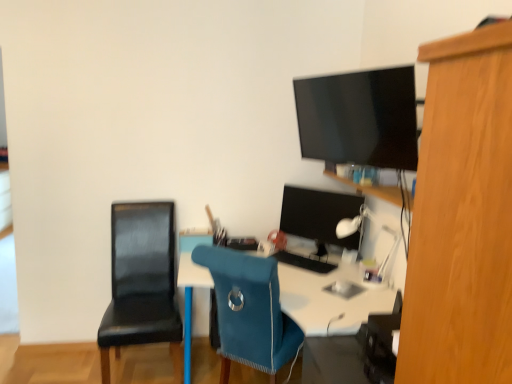
Locate an element on the screen. The image size is (512, 384). white glossy desk at center is located at coordinates (329, 300).

Can black matte keyboard at center be found inside white glossy desk at center?

No.

Which of these two, white glossy desk at center or black matte keyboard at center, is smaller?

A: With smaller size is black matte keyboard at center.

From the picture: Does white glossy desk at center lie behind black matte keyboard at center?

No, the depth of white glossy desk at center is less than that of black matte keyboard at center.

Would you consider white glossy desk at center to be distant from black matte keyboard at center?

No, there isn't a large distance between white glossy desk at center and black matte keyboard at center.

From the picture: From a real-world perspective, is blue fabric chair at center, which is counted as the first chair, starting from the right, beneath matte black monitor at center?

Indeed, from a real-world perspective, blue fabric chair at center, which is counted as the first chair, starting from the right, is positioned beneath matte black monitor at center.

Where is `computer monitor that appears above the blue fabric chair at center, which is counted as the first chair, starting from the right (from the image's perspective)`? computer monitor that appears above the blue fabric chair at center, which is counted as the first chair, starting from the right (from the image's perspective) is located at coordinates (318, 214).

Considering the relative sizes of blue fabric chair at center, the second chair in the left-to-right sequence, and matte black monitor at center in the image provided, is blue fabric chair at center, the second chair in the left-to-right sequence, bigger than matte black monitor at center?

Yes, blue fabric chair at center, the second chair in the left-to-right sequence, is bigger than matte black monitor at center.

Is blue fabric chair at center, which is counted as the first chair, starting from the right, taller than matte black monitor at center?

Yes, blue fabric chair at center, which is counted as the first chair, starting from the right, is taller than matte black monitor at center.

Is black matte keyboard at center looking in the opposite direction of white plastic lamp at upper right?

No, black matte keyboard at center is not facing the opposite direction of white plastic lamp at upper right.

Is black matte keyboard at center with white plastic lamp at upper right?

No, black matte keyboard at center is not touching white plastic lamp at upper right.

Considering the positions of point (322, 268) and point (350, 225), is point (322, 268) closer or farther from the camera than point (350, 225)?

Point (322, 268) is positioned farther from the camera compared to point (350, 225).

From the picture: Which object is more forward, black matte keyboard at center or white plastic lamp at upper right?

white plastic lamp at upper right.

Can you confirm if black matte keyboard at center is positioned to the right of blue fabric chair at center, the second chair in the left-to-right sequence?

Indeed, black matte keyboard at center is positioned on the right side of blue fabric chair at center, the second chair in the left-to-right sequence.

Does point (296, 257) come farther from viewer compared to point (275, 374)?

Yes, it is behind point (275, 374).

Is black matte keyboard at center behind blue fabric chair at center, the second chair in the left-to-right sequence?

Yes.

Considering the positions of point (307, 259) and point (134, 254), is point (307, 259) closer or farther from the camera than point (134, 254)?

Point (307, 259) appears to be farther away from the viewer than point (134, 254).

Is black matte keyboard at center situated inside black leather chair at left, acting as the first chair starting from the left, or outside?

black matte keyboard at center is outside black leather chair at left, acting as the first chair starting from the left.

Is black matte keyboard at center aimed at black leather chair at left, placed as the second chair when sorted from right to left?

No.

Are black matte keyboard at center and black leather chair at left, placed as the second chair when sorted from right to left, beside each other?

No, black matte keyboard at center is not in contact with black leather chair at left, placed as the second chair when sorted from right to left.

Can you confirm if matte black monitor at center is bigger than blue fabric chair at center, the second chair in the left-to-right sequence?

No.

The image size is (512, 384). There is a matte black monitor at center. What are the coordinates of `the 2nd chair below it (from a real-world perspective)` in the screenshot? It's located at (250, 311).

Choose the correct answer: Is matte black monitor at center inside blue fabric chair at center, which is counted as the first chair, starting from the right, or outside it?

matte black monitor at center cannot be found inside blue fabric chair at center, which is counted as the first chair, starting from the right.

Is point (344, 212) positioned in front of point (251, 322)?

That is False.

From a real-world perspective, which object rests below the other?

In real-world perspective, white glossy desk at center is lower.

Is point (353, 264) farther from camera compared to point (326, 233)?

That is False.

Looking at this image, does white glossy desk at center turn towards matte black monitor at center?

No.

Identify the location of keyboard that is on the right side of white glossy desk at center. Image resolution: width=512 pixels, height=384 pixels. (304, 262).

Image resolution: width=512 pixels, height=384 pixels. What are the coordinates of `the 2nd chair in front of the matte black monitor at center` in the screenshot? It's located at (250, 311).

Based on their spatial positions, is black matte keyboard at center or black leather chair at left, acting as the first chair starting from the left, further from blue fabric chair at center, the second chair in the left-to-right sequence?

Based on the image, black leather chair at left, acting as the first chair starting from the left, appears to be further to blue fabric chair at center, the second chair in the left-to-right sequence.

Estimate the real-world distances between objects in this image. Which object is further from blue fabric chair at center, which is counted as the first chair, starting from the right, white plastic lamp at upper right or matte black monitor at center?

Among the two, matte black monitor at center is located further to blue fabric chair at center, which is counted as the first chair, starting from the right.

Based on their spatial positions, is blue fabric chair at center, the second chair in the left-to-right sequence, or matte black monitor at center closer to black leather chair at left, acting as the first chair starting from the left?

blue fabric chair at center, the second chair in the left-to-right sequence, lies closer to black leather chair at left, acting as the first chair starting from the left, than the other object.

Considering their positions, is matte black monitor at center positioned further to white glossy desk at center than black matte keyboard at center?

The object further to white glossy desk at center is matte black monitor at center.

In the scene shown: Estimate the real-world distances between objects in this image. Which object is closer to black matte keyboard at center, blue fabric chair at center, which is counted as the first chair, starting from the right, or white glossy desk at center?

white glossy desk at center is closer to black matte keyboard at center.

Which object lies nearer to the anchor point black matte keyboard at center, black leather chair at left, acting as the first chair starting from the left, or blue fabric chair at center, the second chair in the left-to-right sequence?

blue fabric chair at center, the second chair in the left-to-right sequence.

When comparing their distances from white glossy desk at center, does matte black monitor at center or black leather chair at left, acting as the first chair starting from the left, seem further?

black leather chair at left, acting as the first chair starting from the left.

From the image, which object appears to be nearer to matte black monitor at center, white glossy desk at center or blue fabric chair at center, which is counted as the first chair, starting from the right?

white glossy desk at center is closer to matte black monitor at center.

This screenshot has height=384, width=512. In order to click on lamp between white glossy desk at center and black matte keyboard at center in the front-back direction in this screenshot , I will do `click(378, 228)`.

I want to click on desk situated between black leather chair at left, placed as the second chair when sorted from right to left, and white plastic lamp at upper right from left to right, so click(329, 300).

Identify the location of chair between black leather chair at left, placed as the second chair when sorted from right to left, and matte black monitor at center. (250, 311).

You are a GUI agent. You are given a task and a screenshot of the screen. Output one action in this format:
    pyautogui.click(x=<x>, y=<y>)
    Task: Click on the keyboard positioned between white glossy desk at center and matte black monitor at center from near to far
    The height and width of the screenshot is (384, 512).
    Given the screenshot: What is the action you would take?
    click(x=304, y=262)